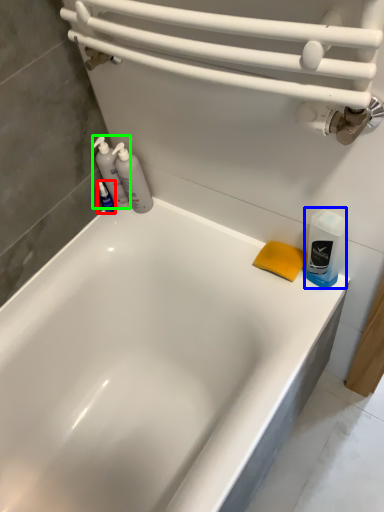
Question: Based on their relative distances, which object is nearer to toiletry (highlighted by a red box)? Choose from cleaning product (highlighted by a blue box) and cleaning product (highlighted by a green box).

Choices:
 (A) cleaning product
 (B) cleaning product

Answer: (B)